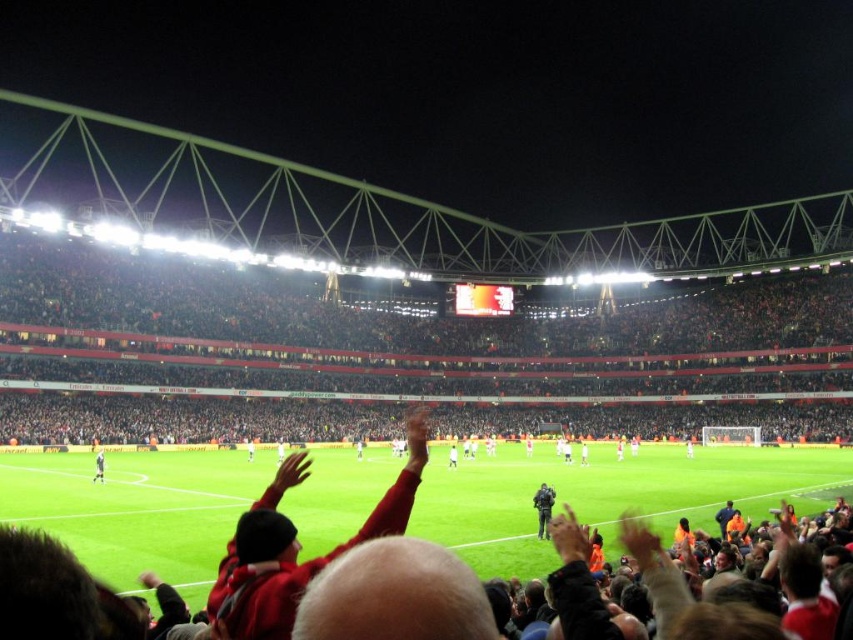
You are a photographer positioned at the center of the stadium, aiming to capture a photo of both the point at coordinates (474,337) and the point at (103,481). Based on their positions, which point will appear closer to the camera in your photo?

Point (474,337) is further to the camera than point (103,481), so in the photo, point (103,481) will appear closer to the camera.

You are a photographer at the stadium and want to capture a photo that includes both the dark red fabric crowd at center and the white jersey at center. Which object will occupy more space in the photo?

The dark red fabric crowd at center will occupy more space in the photo because its width is larger than the white jersey at center.